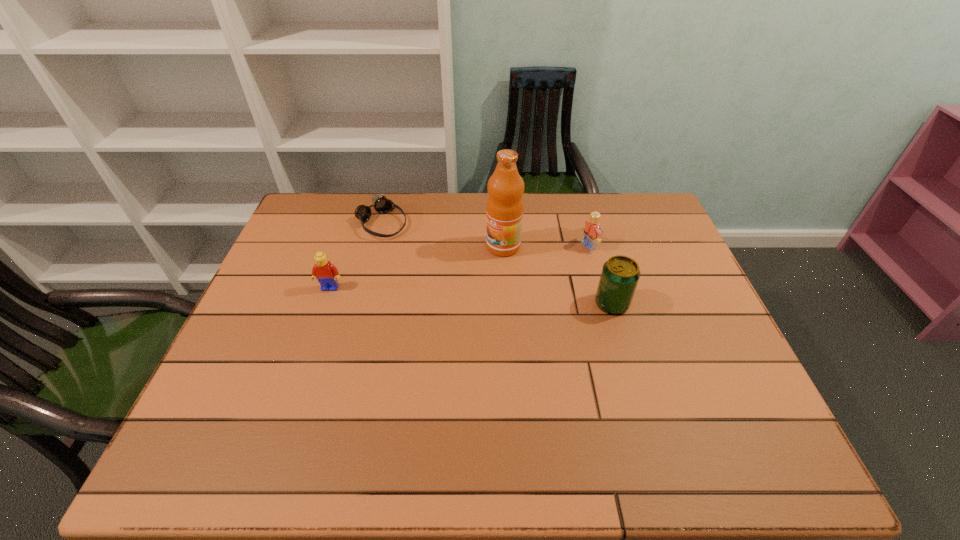
I want to click on free space in the image that satisfies the following two spatial constraints: 1. on the front-facing side of the beer can; 2. on the left side of the nearer Lego, so click(324, 303).